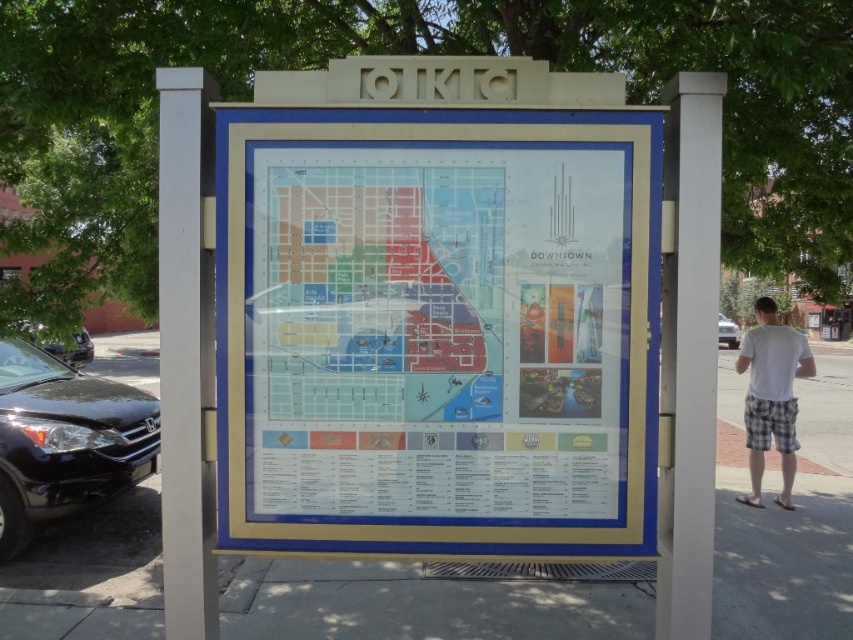
Question: Which of the following is the farthest from the observer?

Choices:
 (A) matte plastic map at center
 (B) white plaid shorts at lower right

Answer: (B)

Question: Is white plastic map at center bigger than white plaid shorts at lower right?

Choices:
 (A) no
 (B) yes

Answer: (A)

Question: Is matte plastic map at center thinner than white plaid shorts at lower right?

Choices:
 (A) yes
 (B) no

Answer: (A)

Question: Which of the following is the farthest from the observer?

Choices:
 (A) matte plastic map at center
 (B) white plaid shorts at lower right

Answer: (B)

Question: Observing the image, what is the correct spatial positioning of white plastic map at center in reference to matte plastic map at center?

Choices:
 (A) above
 (B) below

Answer: (B)

Question: Which point is closer to the camera taking this photo?

Choices:
 (A) (277, 376)
 (B) (540, 618)
 (C) (547, 406)

Answer: (C)